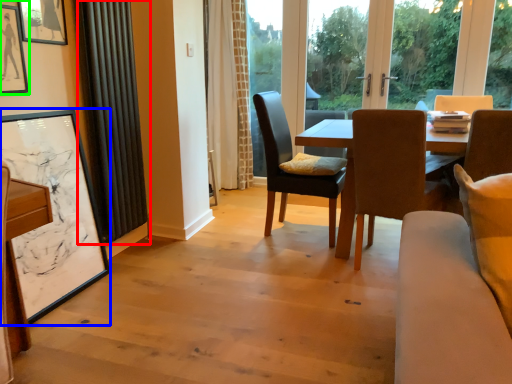
Question: Which is nearer to the curtain (highlighted by a red box)? picture frame (highlighted by a blue box) or picture frame (highlighted by a green box).

Choices:
 (A) picture frame
 (B) picture frame

Answer: (A)